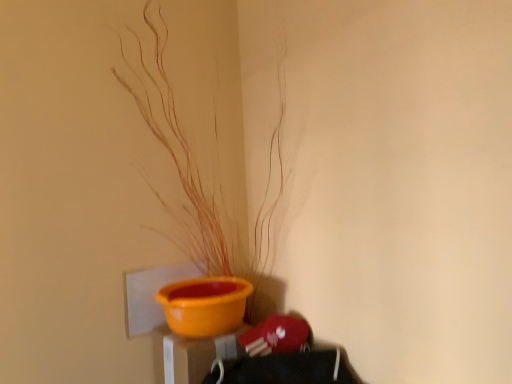
The image size is (512, 384). What do you see at coordinates (195, 169) in the screenshot? I see `orange matte plant at center` at bounding box center [195, 169].

Where is `orange matte plant at center`? Image resolution: width=512 pixels, height=384 pixels. orange matte plant at center is located at coordinates (195, 169).

In order to face orange matte plant at center, should I rotate leftwards or rightwards?

Turn left approximately 7.065 degrees to face it.

Where is `orange matte bowl at lower center`? The width and height of the screenshot is (512, 384). orange matte bowl at lower center is located at coordinates (x=194, y=354).

The width and height of the screenshot is (512, 384). What do you see at coordinates (194, 354) in the screenshot? I see `orange matte bowl at lower center` at bounding box center [194, 354].

Measure the distance between point [174,373] and camera.

Point [174,373] and camera are 1.29 meters apart from each other.

Identify the location of orange matte plant at center. Image resolution: width=512 pixels, height=384 pixels. (195, 169).

Which is more to the left, orange matte plant at center or orange matte bowl at lower center?

orange matte bowl at lower center.

Considering the positions of objects orange matte plant at center and orange matte bowl at lower center in the image provided, who is behind, orange matte plant at center or orange matte bowl at lower center?

orange matte bowl at lower center is further away from the camera.

Which is closer, [217,267] or [182,344]?

Point [217,267] is farther from the camera than point [182,344].

From the image's perspective, who appears lower, orange matte plant at center or orange matte bowl at lower center?

orange matte bowl at lower center.

From a real-world perspective, which is physically above, orange matte plant at center or orange matte bowl at lower center?

orange matte plant at center.

Which of these two, orange matte plant at center or orange matte bowl at lower center, is thinner?

orange matte bowl at lower center is thinner.

Based on the photo, who is taller, orange matte plant at center or orange matte bowl at lower center?

Standing taller between the two is orange matte plant at center.

Does orange matte plant at center have a larger size compared to orange matte bowl at lower center?

Indeed, orange matte plant at center has a larger size compared to orange matte bowl at lower center.

From the picture: Can orange matte bowl at lower center be found inside orange matte plant at center?

No, orange matte bowl at lower center is not surrounded by orange matte plant at center.

Is orange matte plant at center not close to orange matte bowl at lower center?

That's not correct — orange matte plant at center is a little close to orange matte bowl at lower center.

Could you tell me if orange matte plant at center is turned towards orange matte bowl at lower center?

No, orange matte plant at center is not aimed at orange matte bowl at lower center.

How different are the orientations of orange matte plant at center and orange matte bowl at lower center in degrees?

2.77 degrees separate the facing orientations of orange matte plant at center and orange matte bowl at lower center.

Looking at this image, measure the distance between orange matte plant at center and orange matte bowl at lower center.

45.20 centimeters.

Identify the location of houseplant positioned vertically above the orange matte bowl at lower center (from a real-world perspective). (195, 169).

Can you confirm if orange matte bowl at lower center is positioned to the left of orange matte plant at center?

Yes, orange matte bowl at lower center is to the left of orange matte plant at center.

Is the position of orange matte bowl at lower center more distant than that of orange matte plant at center?

Yes, orange matte bowl at lower center is further from the viewer.

Is point (158, 328) positioned in front of point (197, 250)?

Yes, point (158, 328) is closer to viewer.

From the image's perspective, is orange matte bowl at lower center located above orange matte plant at center?

Actually, orange matte bowl at lower center appears below orange matte plant at center in the image.

Looking at this image, from a real-world perspective, which is physically above, orange matte bowl at lower center or orange matte plant at center?

From a 3D spatial view, orange matte plant at center is above.

Between orange matte bowl at lower center and orange matte plant at center, which one has larger width?

orange matte plant at center is wider.

Can you confirm if orange matte bowl at lower center is shorter than orange matte plant at center?

Yes, orange matte bowl at lower center is shorter than orange matte plant at center.

Is orange matte bowl at lower center smaller than orange matte plant at center?

Yes, orange matte bowl at lower center is smaller than orange matte plant at center.

Is orange matte bowl at lower center positioned beyond the bounds of orange matte plant at center?

Yes.

Are orange matte bowl at lower center and orange matte plant at center located far from each other?

No.

Is orange matte bowl at lower center facing away from orange matte plant at center?

No, orange matte plant at center is not at the back of orange matte bowl at lower center.

Can you tell me how much orange matte bowl at lower center and orange matte plant at center differ in facing direction?

There is a 2.77-degree angle between the facing directions of orange matte bowl at lower center and orange matte plant at center.

Where is `table on the left side of orange matte plant at center`? table on the left side of orange matte plant at center is located at coordinates (194, 354).

In order to click on table below the orange matte plant at center (from the image's perspective) in this screenshot , I will do `click(194, 354)`.

Where is `houseplant to the right of orange matte bowl at lower center`? This screenshot has width=512, height=384. houseplant to the right of orange matte bowl at lower center is located at coordinates (195, 169).